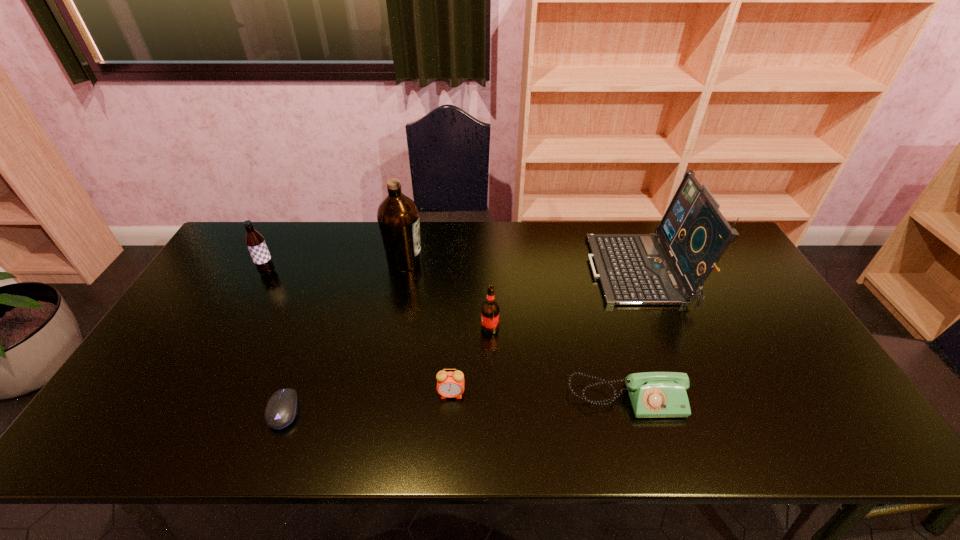
What are the coordinates of `empty space that is in between the shortest object and the laptop computer` in the screenshot? It's located at (463, 341).

Where is `empty space that is in between the shorter root beer and the computer mouse`? The image size is (960, 540). empty space that is in between the shorter root beer and the computer mouse is located at coordinates (387, 369).

Image resolution: width=960 pixels, height=540 pixels. Identify the location of vacant space that's between the telephone and the fifth object from right to left. (516, 330).

Find the location of a particular element. This screenshot has width=960, height=540. free space that is in between the sixth object from right to left and the taller root beer is located at coordinates (276, 341).

Identify the location of vacant region between the shortest object and the telephone. The width and height of the screenshot is (960, 540). (455, 404).

The image size is (960, 540). Find the location of `free space between the shorter root beer and the computer mouse`. free space between the shorter root beer and the computer mouse is located at coordinates (387, 369).

This screenshot has width=960, height=540. Find the location of `unoccupied area between the sixth object from right to left and the farther root beer`. unoccupied area between the sixth object from right to left and the farther root beer is located at coordinates (276, 341).

Locate an element on the screen. vacant point located between the fifth tallest object and the left root beer is located at coordinates (360, 333).

The width and height of the screenshot is (960, 540). In order to click on object that is the nearest to the fifth object from right to left in this screenshot , I will do `click(490, 309)`.

This screenshot has height=540, width=960. Find the location of `the third closest object to the shorter root beer`. the third closest object to the shorter root beer is located at coordinates (398, 217).